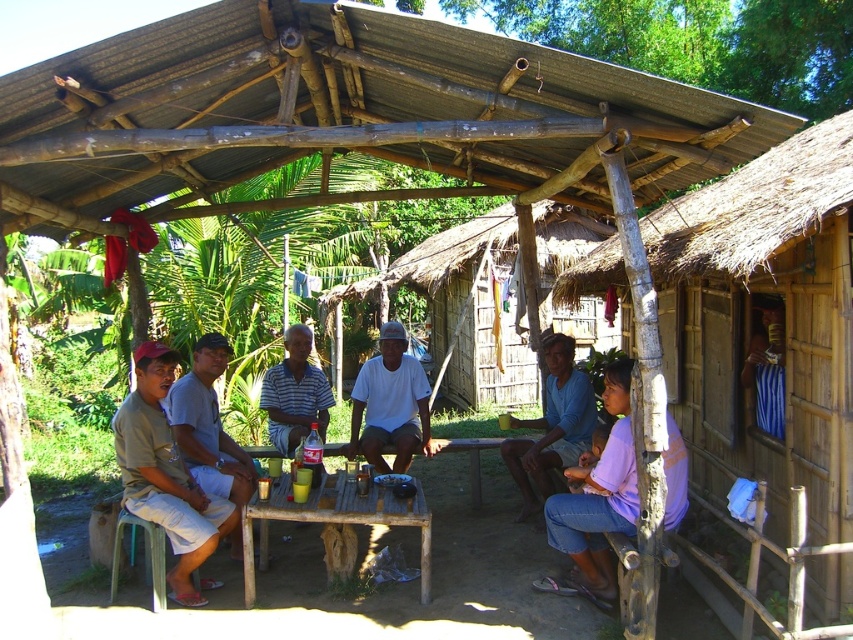
You are a photographer taking a photo of the group under the rustic wooden structure. You notice the white matte shirt at center and the blue cotton shirt at center. Which shirt should you adjust to ensure both shirts are visible in the frame?

You should adjust the blue cotton shirt at center because the white matte shirt at center is located above it, so moving the blue cotton shirt down or the white one up would ensure both are visible.

Consider the image. You are a photographer standing 10 feet away from the group. You want to take a photo that includes both the white matte shirt at center and the blue cotton shirt at center. If your camera has a maximum focus range of 10 feet, will you be able to capture both shirts clearly in the photo?

Yes, both the white matte shirt at center and the blue cotton shirt at center will be within the 10 feet focus range since the photographer is standing exactly 10 feet away from the group. The distance between the two shirts is 38.04 inches, which is about 3.17 feet, so they are close enough to be in focus together.